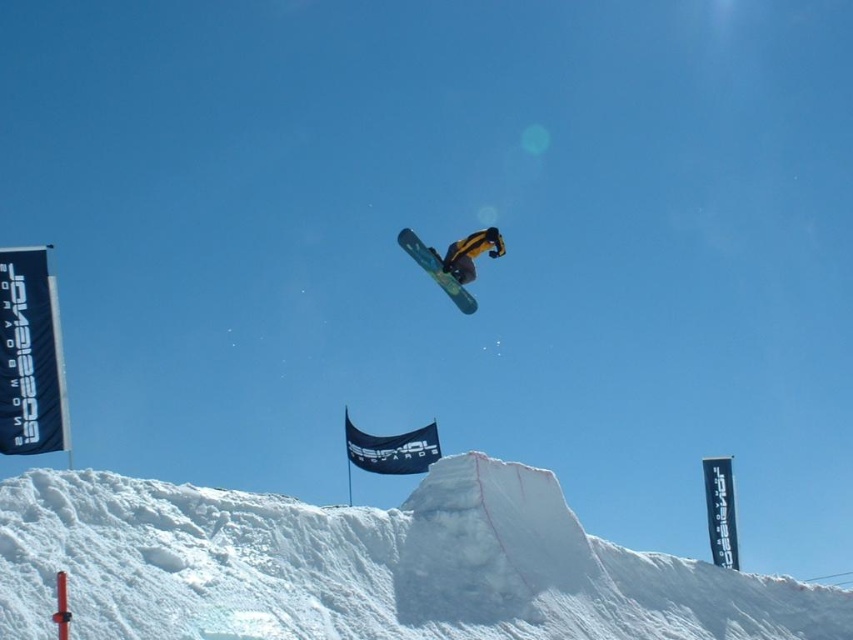
You are a photographer trying to capture the snowboarder midair. You notice the white fluffy snow at center and the blue matte snowboard at center. Which object is closer to the camera lens?

The white fluffy snow at center is in front of the blue matte snowboard at center, so it is closer to the camera lens.

You are a drone operator trying to capture the snowboarder midair. You need to position your drone between the two points, point[401,237] and point[473,268]. Which point should the drone be closer to in order to film the snowboarder from the front?

The drone should be positioned closer to point[401,237] because it is in front of point[473,268], so being closer to the front point will allow the camera to face the snowboarder head on.

You are a photographer trying to capture the snowboarder midair. The white fluffy snow at center and the yellow matte snowboarder at center are both in your viewfinder. Which object is higher in the frame?

The yellow matte snowboarder at center is higher in the frame because the white fluffy snow at center is much taller than it, meaning the snow is positioned lower down.